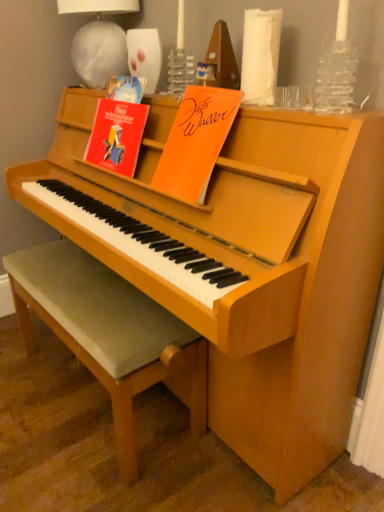
Question: Should I look upward or downward to see orange paper at upper center, which is counted as the 2th paperback book, starting from the left?

Choices:
 (A) up
 (B) down

Answer: (A)

Question: Is white fabric lampshade at upper center to the left of orange paper at upper center, which is counted as the 2th paperback book, starting from the left, from the viewer's perspective?

Choices:
 (A) yes
 (B) no

Answer: (A)

Question: From a real-world perspective, is white fabric lampshade at upper center on top of orange paper at upper center, which is counted as the 2th paperback book, starting from the left?

Choices:
 (A) no
 (B) yes

Answer: (B)

Question: Considering the relative sizes of white fabric lampshade at upper center and orange paper at upper center, which is counted as the 2th paperback book, starting from the left, in the image provided, is white fabric lampshade at upper center bigger than orange paper at upper center, which is counted as the 2th paperback book, starting from the left,?

Choices:
 (A) yes
 (B) no

Answer: (A)

Question: Is white fabric lampshade at upper center thinner than orange paper at upper center, which appears as the first paperback book when viewed from the right?

Choices:
 (A) yes
 (B) no

Answer: (A)

Question: Can you confirm if white fabric lampshade at upper center is shorter than orange paper at upper center, which appears as the first paperback book when viewed from the right?

Choices:
 (A) no
 (B) yes

Answer: (A)

Question: Is the position of white fabric lampshade at upper center less distant than that of orange paper at upper center, which appears as the first paperback book when viewed from the right?

Choices:
 (A) yes
 (B) no

Answer: (B)

Question: Can you confirm if orange paper at upper center, which appears as the first paperback book when viewed from the right, is shorter than light brown wooden stool at center?

Choices:
 (A) yes
 (B) no

Answer: (A)

Question: Would you say orange paper at upper center, which is counted as the 2th paperback book, starting from the left, contains light brown wooden stool at center?

Choices:
 (A) yes
 (B) no

Answer: (B)

Question: Considering the relative sizes of orange paper at upper center, which appears as the first paperback book when viewed from the right, and light brown wooden stool at center in the image provided, is orange paper at upper center, which appears as the first paperback book when viewed from the right, thinner than light brown wooden stool at center?

Choices:
 (A) yes
 (B) no

Answer: (A)

Question: Is orange paper at upper center, which is counted as the 2th paperback book, starting from the left, placed right next to light brown wooden stool at center?

Choices:
 (A) yes
 (B) no

Answer: (B)

Question: Is orange paper at upper center, which appears as the first paperback book when viewed from the right, wider than light brown wooden stool at center?

Choices:
 (A) yes
 (B) no

Answer: (B)

Question: From the image's perspective, is orange paper at upper center, which appears as the first paperback book when viewed from the right, located beneath light brown wooden stool at center?

Choices:
 (A) no
 (B) yes

Answer: (A)

Question: Is light brown wooden stool at center shorter than red paper at upper left, which is counted as the 1th paperback book, starting from the left?

Choices:
 (A) yes
 (B) no

Answer: (B)